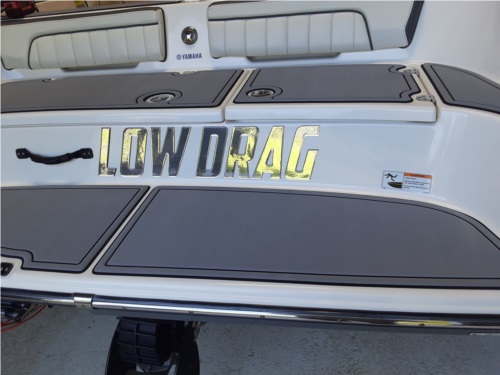
Locate an element on the screen. This screenshot has height=375, width=500. hinges is located at coordinates (413, 71), (426, 100), (52, 78), (184, 72).